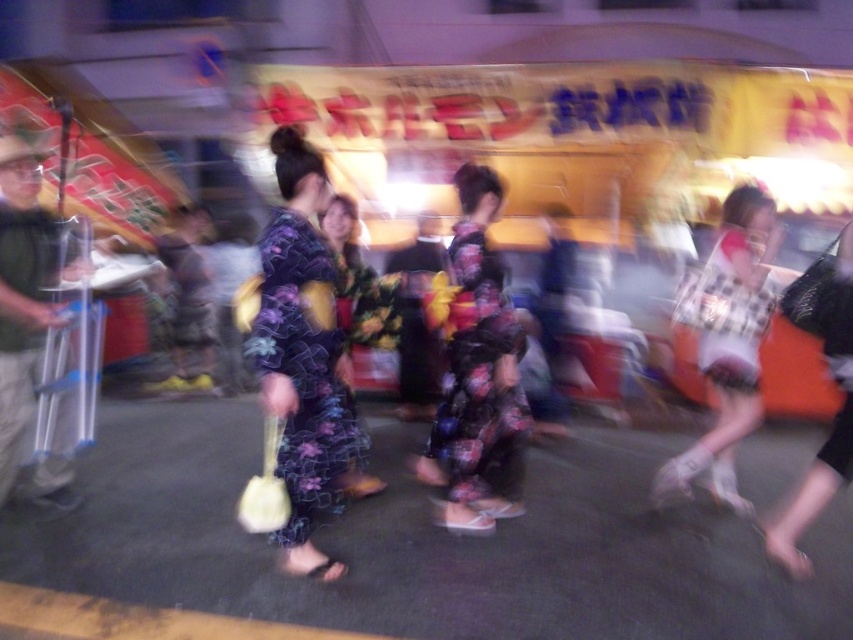
Question: Is checkered fabric bag at right above plaid fabric dress at right?

Choices:
 (A) yes
 (B) no

Answer: (B)

Question: Which point is closer to the camera?

Choices:
 (A) floral fabric dress at center
 (B) floral fabric kimono at center
 (C) floral silk kimono at center

Answer: (C)

Question: Where is plaid fabric dress at right located in relation to floral fabric kimono at center in the image?

Choices:
 (A) below
 (B) above

Answer: (A)

Question: Is floral fabric dress at center positioned before checkered fabric bag at right?

Choices:
 (A) no
 (B) yes

Answer: (B)

Question: Based on their relative distances, which object is nearer to the plaid fabric dress at right?

Choices:
 (A) checkered fabric bag at right
 (B) floral fabric dress at center
 (C) floral fabric kimono at center
 (D) floral silk kimono at center

Answer: (A)

Question: Which of the following is the closest to the observer?

Choices:
 (A) (453, 237)
 (B) (721, 396)

Answer: (A)